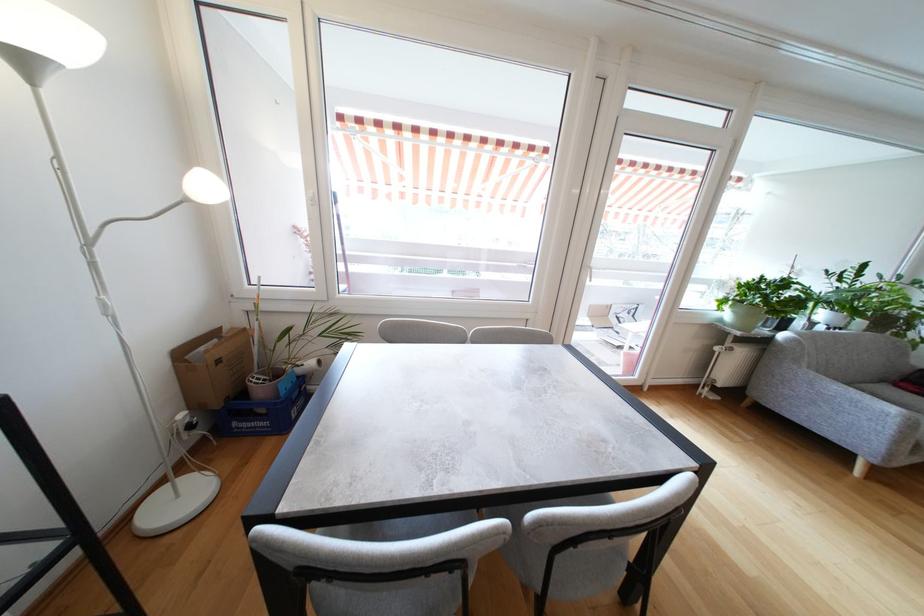
Describe the element at coordinates (845, 357) in the screenshot. The image size is (924, 616). I see `a sofa sitting surface` at that location.